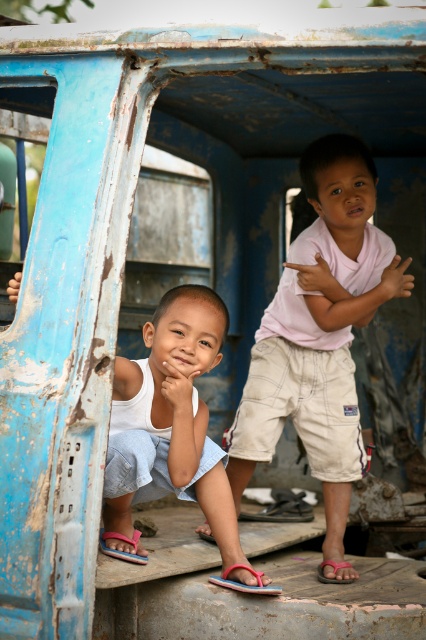
Which of these two, white denim shorts at lower left or pink rubber sandal at lower center, stands taller?

With more height is white denim shorts at lower left.

Who is positioned more to the right, white denim shorts at lower left or pink rubber sandal at lower center?

From the viewer's perspective, pink rubber sandal at lower center appears more on the right side.

Which is in front, point (117, 381) or point (259, 593)?

Point (259, 593) is in front.

Where is `white denim shorts at lower left`? white denim shorts at lower left is located at coordinates (170, 419).

Describe the element at coordinates (319, 333) in the screenshot. The height and width of the screenshot is (640, 426). I see `pink cotton shirt at upper right` at that location.

Looking at this image, between pink cotton shirt at upper right and pink fabric sandal at lower center, which one is positioned higher?

Positioned higher is pink cotton shirt at upper right.

What do you see at coordinates (319, 333) in the screenshot? Image resolution: width=426 pixels, height=640 pixels. I see `pink cotton shirt at upper right` at bounding box center [319, 333].

Find the location of a particular element. The width and height of the screenshot is (426, 640). pink cotton shirt at upper right is located at coordinates (319, 333).

Does pink rubber sandal at lower center have a greater width compared to pink fabric sandal at lower left?

Correct, the width of pink rubber sandal at lower center exceeds that of pink fabric sandal at lower left.

Who is more distant from viewer, (250, 588) or (126, 556)?

Point (126, 556)

Is point (273, 589) closer to camera compared to point (135, 544)?

That is True.

Locate an element on the screen. The image size is (426, 640). pink rubber sandal at lower center is located at coordinates (242, 582).